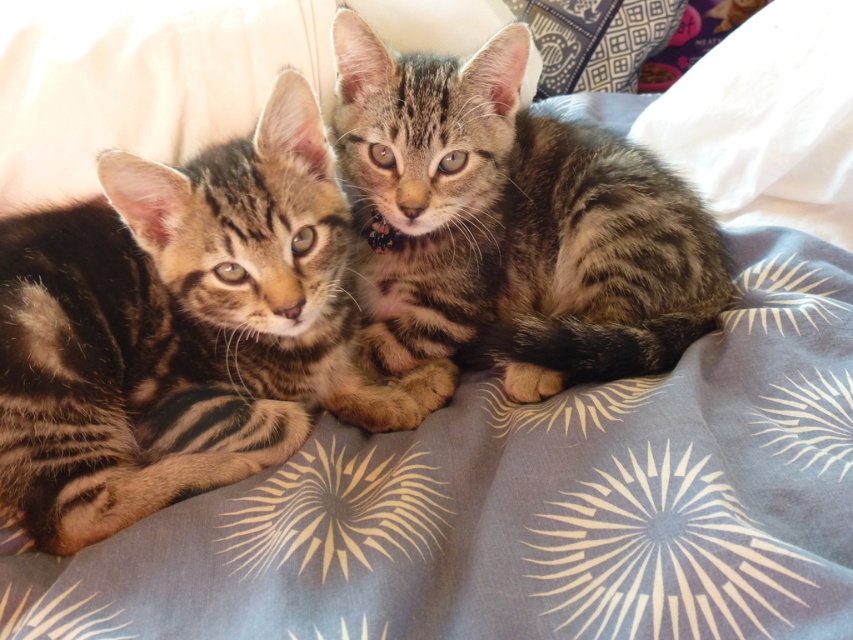
Question: Does striped fur kitten at center appear on the right side of tabby fur kitten at center?

Choices:
 (A) yes
 (B) no

Answer: (B)

Question: Which of the following is the farthest from the observer?

Choices:
 (A) tabby fur kitten at center
 (B) striped fur kitten at center

Answer: (A)

Question: Does striped fur kitten at center have a lesser width compared to tabby fur kitten at center?

Choices:
 (A) yes
 (B) no

Answer: (A)

Question: Is striped fur kitten at center bigger than tabby fur kitten at center?

Choices:
 (A) yes
 (B) no

Answer: (B)

Question: Which object is closer to the camera taking this photo?

Choices:
 (A) tabby fur kitten at center
 (B) striped fur kitten at center

Answer: (B)

Question: Which point appears farthest from the camera in this image?

Choices:
 (A) (483, 228)
 (B) (270, 346)

Answer: (A)